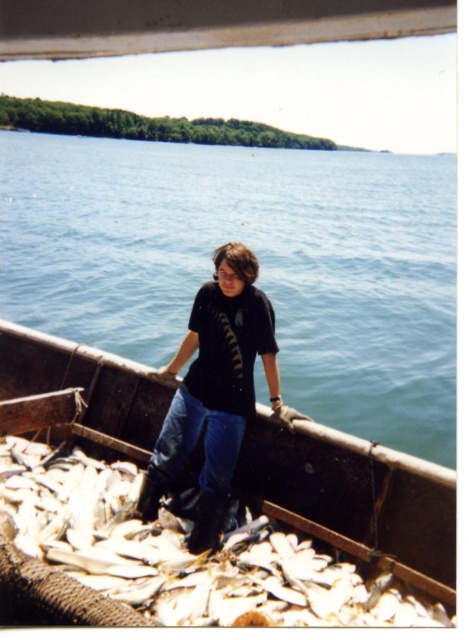
You are a photographer trying to capture the fish on the boat. You notice the white matte fish at lower center and the black matte shirt at center. Which object is wider?

The white matte fish at lower center is wider than the black matte shirt at center.

You are a fisherman on the boat and want to place a new fishing net between the blue water at center and the white matte fish at lower center. Since the net requires a vertical space, which object should you consider for placement based on their height?

The blue water at center is taller than the white matte fish at lower center, so you should consider placing the net near the blue water at center to accommodate the vertical space requirement.